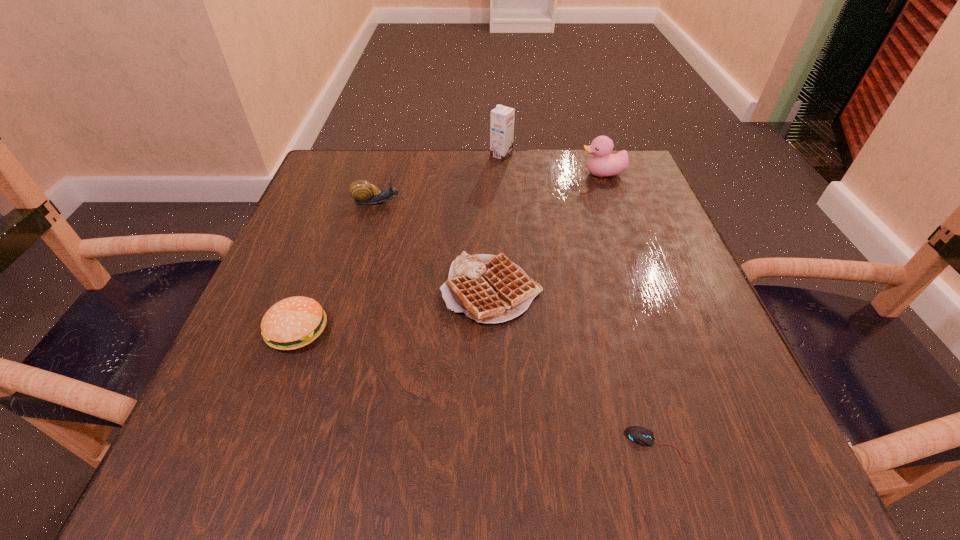
Locate an element on the screen. Image resolution: width=960 pixels, height=540 pixels. vacant area situated on the right of the farthest object is located at coordinates (576, 155).

Locate an element on the screen. The image size is (960, 540). vacant area located 0.190m on the front-facing side of the duckling is located at coordinates (500, 174).

I want to click on vacant region located 0.340m on the front-facing side of the duckling, so click(x=437, y=174).

The image size is (960, 540). I want to click on free space located 0.180m on the front-facing side of the duckling, so click(504, 174).

Find the location of a particular element. The width and height of the screenshot is (960, 540). blank area located on the front-facing side of the escargot is located at coordinates (499, 202).

Locate an element on the screen. This screenshot has width=960, height=540. vacant space situated 0.190m on the back of the third shortest object is located at coordinates (332, 237).

Locate an element on the screen. This screenshot has width=960, height=540. free space located on the back of the fifth tallest object is located at coordinates (490, 222).

Locate an element on the screen. The height and width of the screenshot is (540, 960). free space located 0.070m on the back of the nearest object is located at coordinates (638, 382).

Where is `chocolate milk that is positioned at the far edge`? The height and width of the screenshot is (540, 960). chocolate milk that is positioned at the far edge is located at coordinates (502, 118).

At what (x,y) coordinates should I click in order to perform the action: click on duckling at the far edge. Please return your answer as a coordinate pair (x, y). Image resolution: width=960 pixels, height=540 pixels. Looking at the image, I should click on (603, 164).